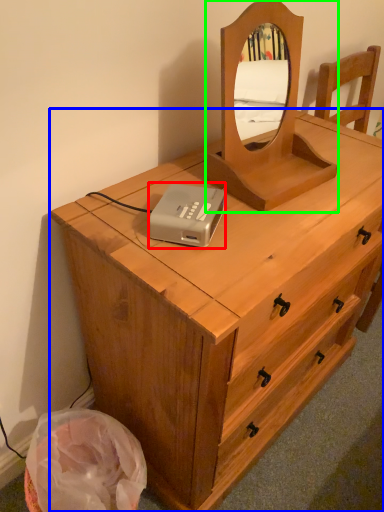
Question: Which object is positioned farthest from cassette (highlighted by a red box)? Select from chest of drawers (highlighted by a blue box) and mirror (highlighted by a green box).

Choices:
 (A) chest of drawers
 (B) mirror

Answer: (A)